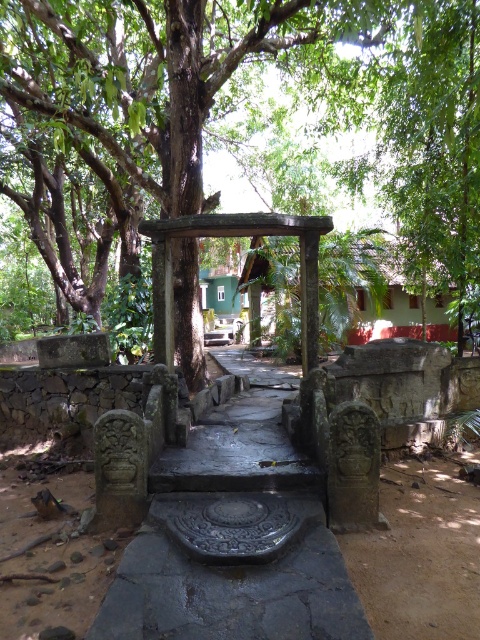
Who is more distant from viewer, (192, 136) or (187, 227)?

The point (192, 136) is more distant.

Who is more forward, (143,8) or (163,320)?

Point (163,320)

Image resolution: width=480 pixels, height=640 pixels. Describe the element at coordinates (155, 74) in the screenshot. I see `green leafy tree at center` at that location.

Where is `green leafy tree at center`? This screenshot has height=640, width=480. green leafy tree at center is located at coordinates (155, 74).